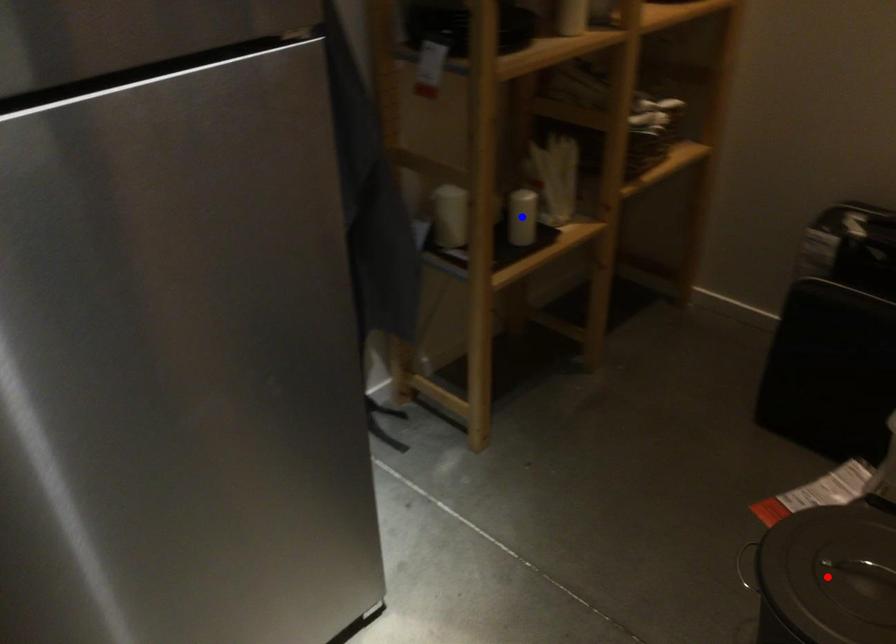
Question: In the image, two points are highlighted. Which point is nearer to the camera? Reply with the corresponding letter.

Choices:
 (A) blue point
 (B) red point

Answer: (B)